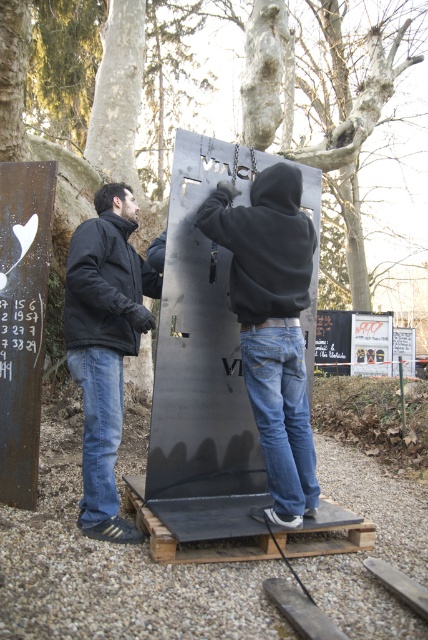
You are a delivery person who needs to place a package between the black matte jacket at left and the black metal sign at left. The package is 24 inches long. Can you fit it between them?

The distance between the black matte jacket at left and the black metal sign at left is 22.61 inches. Since the package is 24 inches long, it is 1.39 inches too long to fit between them.